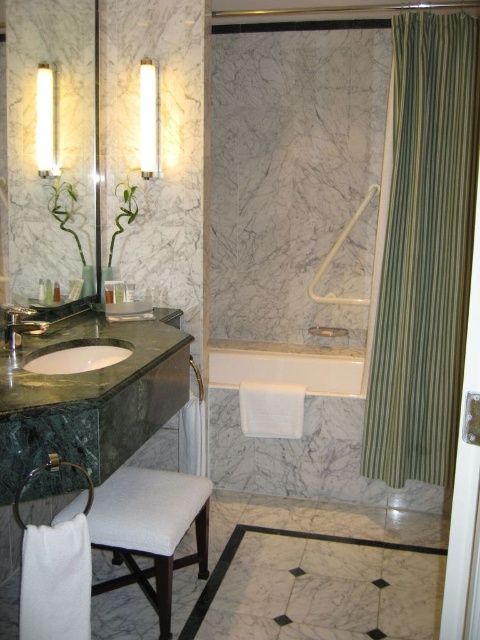
You are a decorator planning to place a new decorative item between the matte glass mirror at left and the matte green marble faucet at left. Which object should you place it closer to to ensure it doesn

The matte glass mirror at left is bigger than the matte green marble faucet at left, so placing the decorative item closer to the matte green marble faucet at left would balance the visual weight between the two objects.

You are a bathroom designer planning to install a new light fixture above the green marble counter top at left and the matte glass mirror at left. Based on their current positions, can you place the light fixture above both objects without it being blocked?

The green marble counter top at left is positioned under the matte glass mirror at left, so placing a light fixture above both would require positioning it above the mirror since the counter is beneath it. However, this might cast shadows. Alternatively, placing it above the counter could block the mirror. A better solution might be to install separate fixtures or adjust their positions for optimal lighting without obstruction.